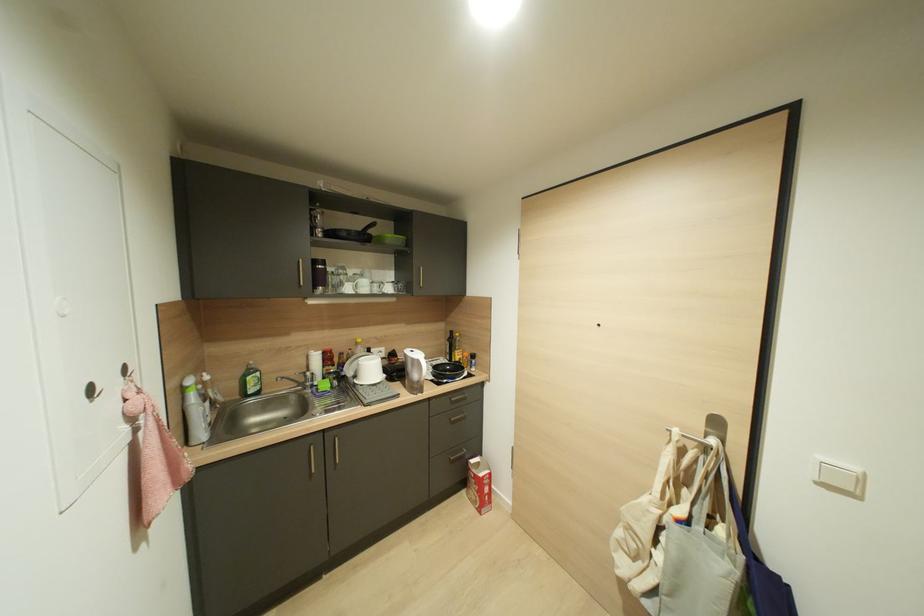
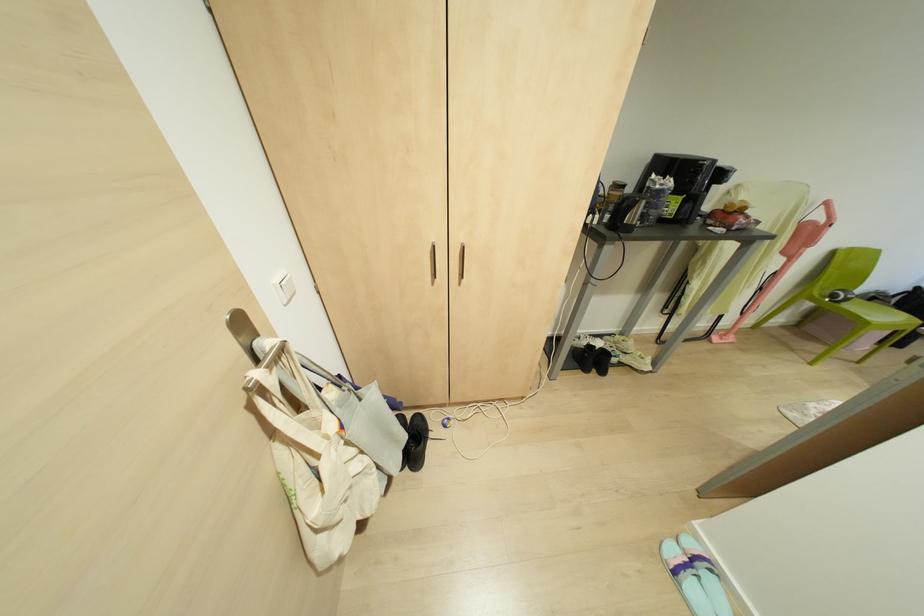
Where in the second image is the point corresponding to (x=678, y=522) from the first image?

(342, 426)